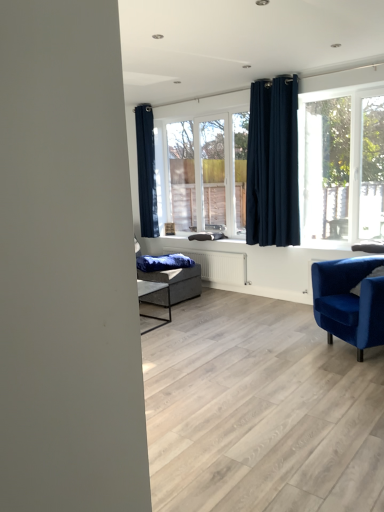
The height and width of the screenshot is (512, 384). I want to click on vacant space situated on the left part of velvet blue armchair at lower right, so click(x=271, y=342).